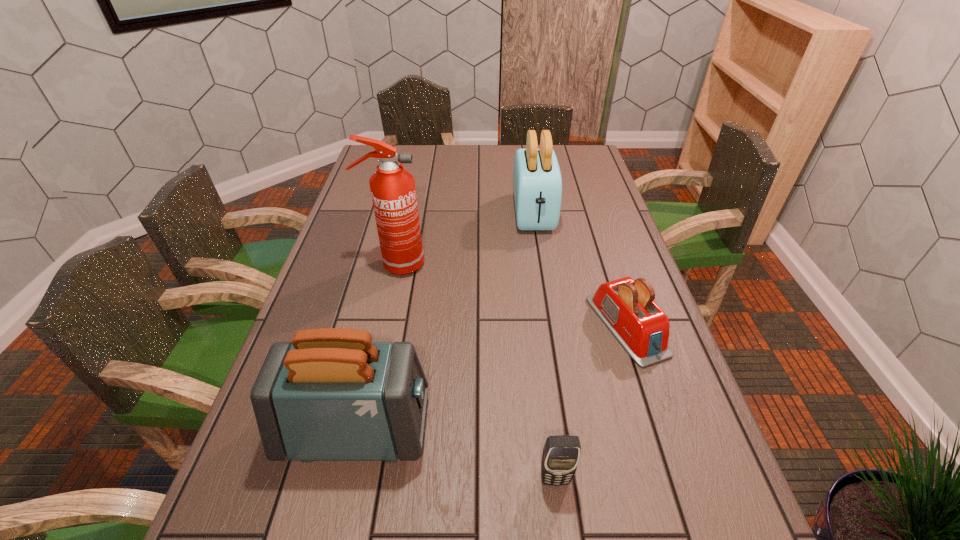
This screenshot has height=540, width=960. I want to click on free point that satisfies the following two spatial constraints: 1. on the side of the shortest toaster with the lever; 2. on the left side of the second toaster from right to left, so click(551, 326).

Identify the location of vacant space that satisfies the following two spatial constraints: 1. on the side of the rightmost toaster with the lever; 2. on the right side of the farthest object. (551, 326).

Where is `free point that satisfies the following two spatial constraints: 1. at the nozzle of the tallest object; 2. on the left side of the shortest toaster`? free point that satisfies the following two spatial constraints: 1. at the nozzle of the tallest object; 2. on the left side of the shortest toaster is located at coordinates (382, 326).

The height and width of the screenshot is (540, 960). I want to click on free region that satisfies the following two spatial constraints: 1. on the side of the rightmost toaster with the lever; 2. on the left side of the farthest toaster, so click(x=551, y=326).